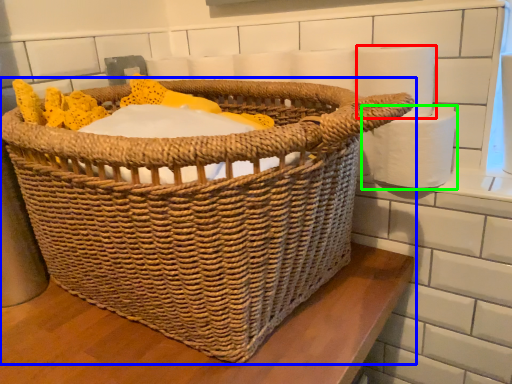
Question: Which is nearer to the toilet paper (highlighted by a red box)? picnic basket (highlighted by a blue box) or toilet paper (highlighted by a green box).

Choices:
 (A) picnic basket
 (B) toilet paper

Answer: (B)